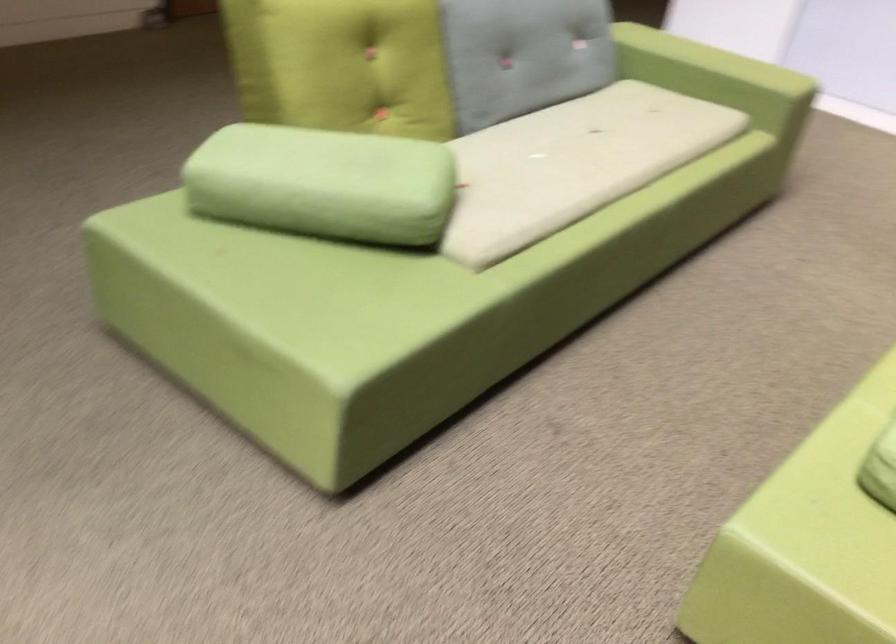
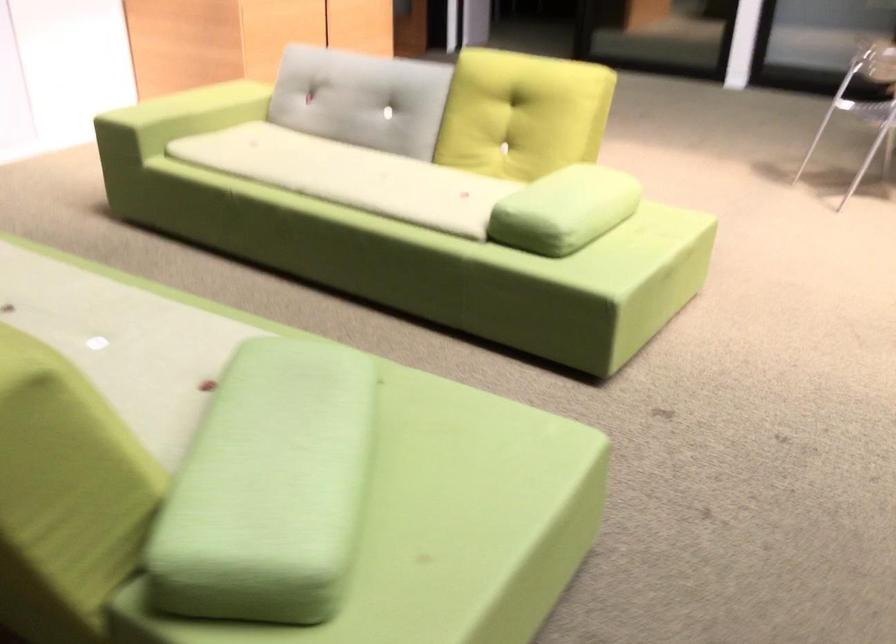
Find the pixel in the second image that matches pixel 246 77 in the first image.

(64, 497)